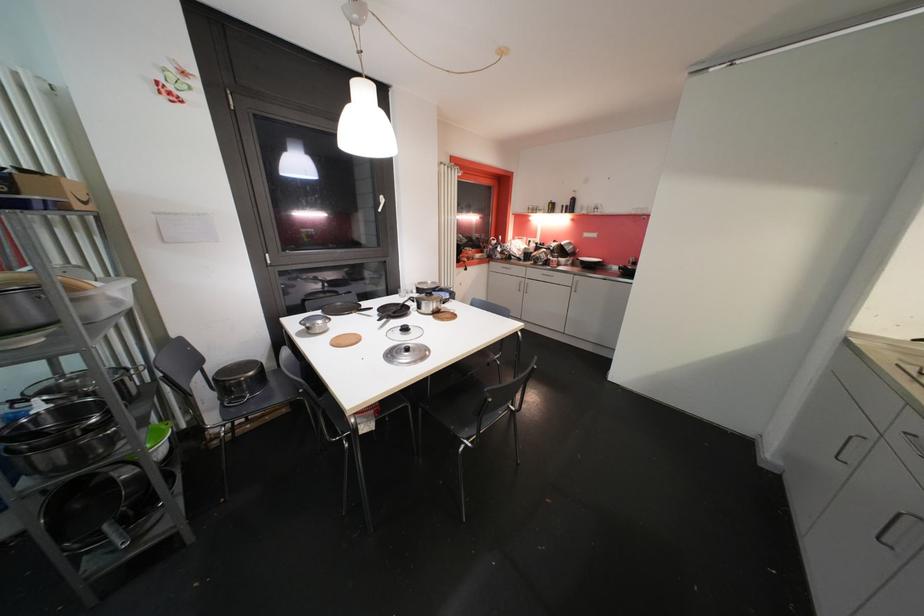
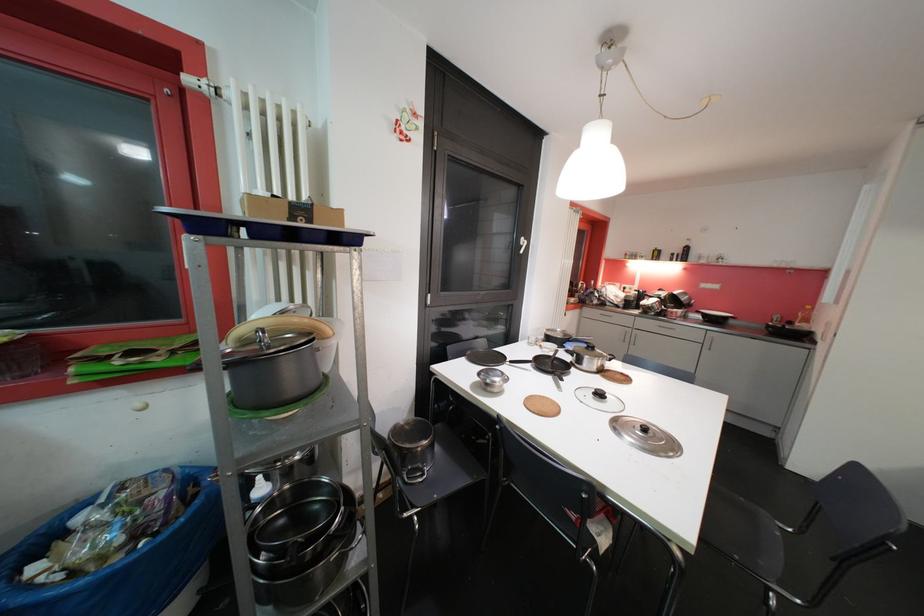
Find the pixel in the second image that matches (409,331) in the first image.

(604, 397)